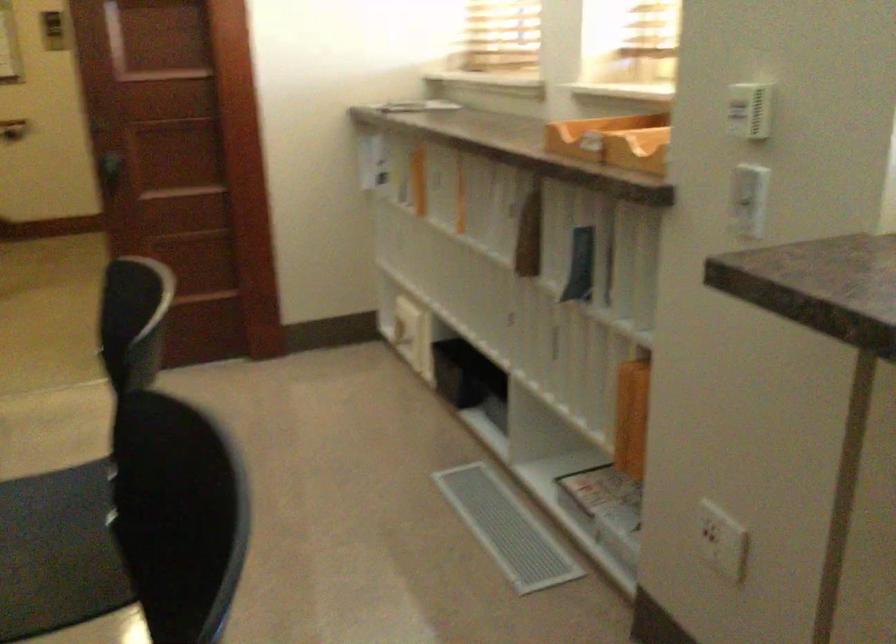
Image resolution: width=896 pixels, height=644 pixels. Describe the element at coordinates (748, 190) in the screenshot. I see `a white light switch` at that location.